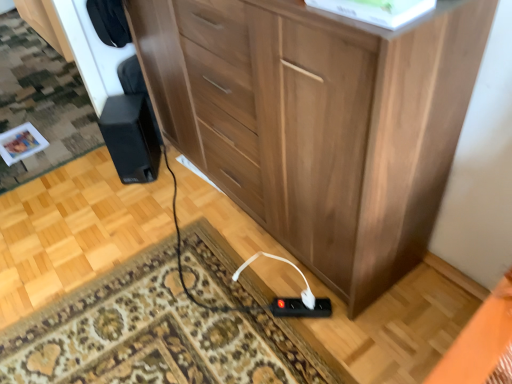
This screenshot has height=384, width=512. I want to click on black plastic power strip at lower center, positioned as the first plug in left-to-right order, so click(x=300, y=308).

Which object is positioned more to the left, black matte speaker at lower left or white plastic plug at lower center, positioned as the second plug in left-to-right order?

Positioned to the left is black matte speaker at lower left.

Could you tell me if black matte speaker at lower left is turned towards white plastic plug at lower center, positioned as the second plug in left-to-right order?

No.

Is white plastic plug at lower center, the first plug from the right, a part of black matte speaker at lower left?

No, white plastic plug at lower center, the first plug from the right, is not inside black matte speaker at lower left.

Identify the location of speaker behind the white plastic plug at lower center, the first plug from the right. This screenshot has height=384, width=512. (131, 137).

Where is `the 1st plug in front of the black matte speaker at lower left, counting from the anchor's position`? Image resolution: width=512 pixels, height=384 pixels. the 1st plug in front of the black matte speaker at lower left, counting from the anchor's position is located at coordinates (300, 308).

From the picture: Considering the sizes of objects black plastic power strip at lower center, which is counted as the 2th plug, starting from the right, and black matte speaker at lower left in the image provided, who is thinner, black plastic power strip at lower center, which is counted as the 2th plug, starting from the right, or black matte speaker at lower left?

With smaller width is black plastic power strip at lower center, which is counted as the 2th plug, starting from the right.

From a real-world perspective, relative to black matte speaker at lower left, is black plastic power strip at lower center, positioned as the first plug in left-to-right order, vertically above or below?

black plastic power strip at lower center, positioned as the first plug in left-to-right order, is below black matte speaker at lower left.

Are black plastic power strip at lower center, positioned as the first plug in left-to-right order, and black matte speaker at lower left making contact?

No, black plastic power strip at lower center, positioned as the first plug in left-to-right order, is not touching black matte speaker at lower left.

The height and width of the screenshot is (384, 512). Find the location of `plug that is on the right side of black plastic power strip at lower center, positioned as the first plug in left-to-right order`. plug that is on the right side of black plastic power strip at lower center, positioned as the first plug in left-to-right order is located at coordinates (308, 299).

Could you tell me if white plastic plug at lower center, positioned as the second plug in left-to-right order, is facing black plastic power strip at lower center, positioned as the first plug in left-to-right order?

No, white plastic plug at lower center, positioned as the second plug in left-to-right order, is not oriented towards black plastic power strip at lower center, positioned as the first plug in left-to-right order.

Does point (308, 289) come farther from viewer compared to point (296, 310)?

No, (308, 289) is in front of (296, 310).

Is the depth of white plastic plug at lower center, positioned as the second plug in left-to-right order, less than that of black plastic power strip at lower center, positioned as the first plug in left-to-right order?

That is True.

Is point (121, 148) behind point (330, 314)?

Yes, point (121, 148) is behind point (330, 314).

Considering the positions of objects black matte speaker at lower left and black plastic power strip at lower center, positioned as the first plug in left-to-right order, in the image provided, who is more to the left, black matte speaker at lower left or black plastic power strip at lower center, positioned as the first plug in left-to-right order,?

black matte speaker at lower left is more to the left.

Considering the sizes of objects black matte speaker at lower left and black plastic power strip at lower center, positioned as the first plug in left-to-right order, in the image provided, who is smaller, black matte speaker at lower left or black plastic power strip at lower center, positioned as the first plug in left-to-right order,?

black plastic power strip at lower center, positioned as the first plug in left-to-right order.

Between black matte speaker at lower left and black plastic power strip at lower center, which is counted as the 2th plug, starting from the right, which one has smaller width?

black plastic power strip at lower center, which is counted as the 2th plug, starting from the right, is thinner.

Could you measure the distance between white plastic plug at lower center, positioned as the second plug in left-to-right order, and black matte speaker at lower left?

A distance of 37.40 inches exists between white plastic plug at lower center, positioned as the second plug in left-to-right order, and black matte speaker at lower left.

Considering the points (304, 301) and (125, 154), which point is behind, point (304, 301) or point (125, 154)?

The point (125, 154) is behind.

From the image's perspective, would you say white plastic plug at lower center, the first plug from the right, is positioned over black matte speaker at lower left?

No, from the image's perspective, white plastic plug at lower center, the first plug from the right, is not above black matte speaker at lower left.

Does white plastic plug at lower center, positioned as the second plug in left-to-right order, appear on the right side of black matte speaker at lower left?

Yes.

Based on the photo, does black plastic power strip at lower center, positioned as the first plug in left-to-right order, have a greater height compared to white plastic plug at lower center, the first plug from the right?

Yes, black plastic power strip at lower center, positioned as the first plug in left-to-right order, is taller than white plastic plug at lower center, the first plug from the right.

Considering the sizes of black plastic power strip at lower center, positioned as the first plug in left-to-right order, and white plastic plug at lower center, positioned as the second plug in left-to-right order, in the image, is black plastic power strip at lower center, positioned as the first plug in left-to-right order, wider or thinner than white plastic plug at lower center, positioned as the second plug in left-to-right order,?

Considering their sizes, black plastic power strip at lower center, positioned as the first plug in left-to-right order, looks broader than white plastic plug at lower center, positioned as the second plug in left-to-right order.

Between black plastic power strip at lower center, positioned as the first plug in left-to-right order, and white plastic plug at lower center, the first plug from the right, which one appears on the left side from the viewer's perspective?

Positioned to the left is black plastic power strip at lower center, positioned as the first plug in left-to-right order.

In the scene shown: Is black plastic power strip at lower center, which is counted as the 2th plug, starting from the right, completely or partially outside of white plastic plug at lower center, positioned as the second plug in left-to-right order?

That's correct, black plastic power strip at lower center, which is counted as the 2th plug, starting from the right, is outside of white plastic plug at lower center, positioned as the second plug in left-to-right order.

The image size is (512, 384). Identify the location of speaker behind the white plastic plug at lower center, positioned as the second plug in left-to-right order. (131, 137).

Find the location of a particular element. The image size is (512, 384). speaker positioned vertically above the black plastic power strip at lower center, positioned as the first plug in left-to-right order (from a real-world perspective) is located at coordinates (131, 137).

Estimate the real-world distances between objects in this image. Which object is closer to black plastic power strip at lower center, which is counted as the 2th plug, starting from the right, black matte speaker at lower left or white plastic plug at lower center, the first plug from the right?

white plastic plug at lower center, the first plug from the right, lies closer to black plastic power strip at lower center, which is counted as the 2th plug, starting from the right, than the other object.

From the image, which object appears to be nearer to black matte speaker at lower left, black plastic power strip at lower center, which is counted as the 2th plug, starting from the right, or white plastic plug at lower center, positioned as the second plug in left-to-right order?

black plastic power strip at lower center, which is counted as the 2th plug, starting from the right, is positioned closer to the anchor black matte speaker at lower left.

Based on their spatial positions, is white plastic plug at lower center, the first plug from the right, or black matte speaker at lower left closer to black plastic power strip at lower center, positioned as the first plug in left-to-right order?

white plastic plug at lower center, the first plug from the right, is positioned closer to the anchor black plastic power strip at lower center, positioned as the first plug in left-to-right order.

Which object lies further to the anchor point black matte speaker at lower left, white plastic plug at lower center, the first plug from the right, or black plastic power strip at lower center, positioned as the first plug in left-to-right order?

Among the two, white plastic plug at lower center, the first plug from the right, is located further to black matte speaker at lower left.

From the image, which object appears to be farther from white plastic plug at lower center, positioned as the second plug in left-to-right order, black plastic power strip at lower center, which is counted as the 2th plug, starting from the right, or black matte speaker at lower left?

black matte speaker at lower left.

Looking at the image, which one is located closer to white plastic plug at lower center, positioned as the second plug in left-to-right order, black matte speaker at lower left or black plastic power strip at lower center, positioned as the first plug in left-to-right order?

black plastic power strip at lower center, positioned as the first plug in left-to-right order, is closer to white plastic plug at lower center, positioned as the second plug in left-to-right order.

Locate an element on the screen. The image size is (512, 384). plug between black matte speaker at lower left and white plastic plug at lower center, positioned as the second plug in left-to-right order, from left to right is located at coordinates (300, 308).